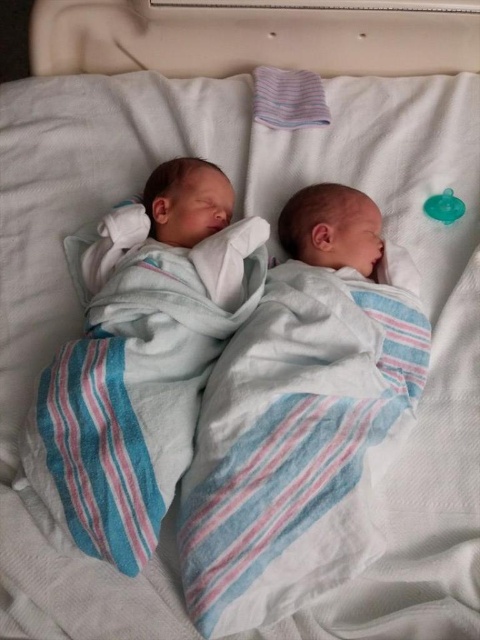
Identify the location of white striped swaddle at center. This screenshot has height=640, width=480. (300, 417).

Where is `white striped swaddle at center`? The height and width of the screenshot is (640, 480). white striped swaddle at center is located at coordinates (300, 417).

What are the coordinates of `white striped swaddle at center` in the screenshot? It's located at (300, 417).